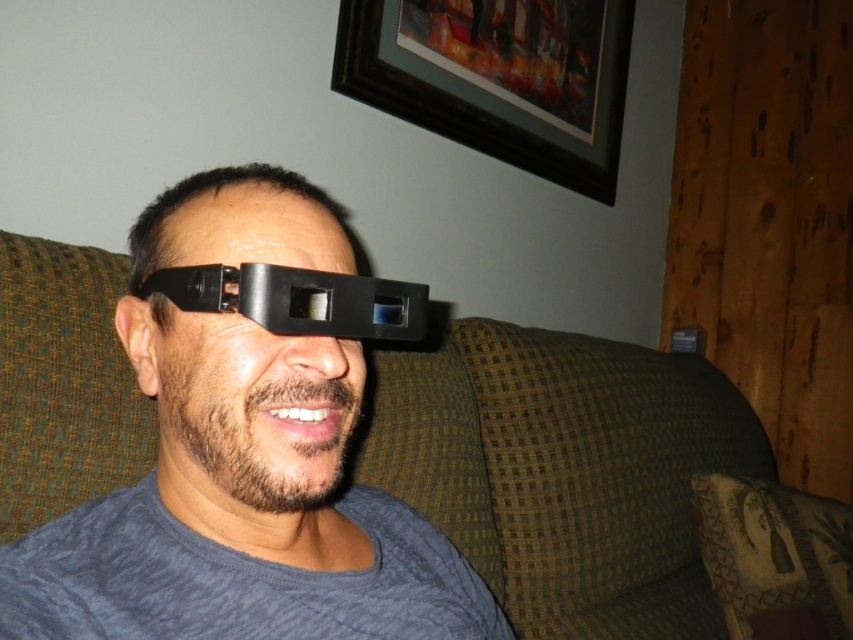
You are a photographer standing at a distance of 16 inches from a subject. You want to take a closeup shot of the black matte glasses at center. Based on the scene description, will the glasses be in focus if your camera is set to focus at 16 inches?

The black matte glasses at center is 15.95 inches from viewer. Since the camera is set to focus at 16 inches, which is very close to the actual distance of 15.95 inches, the glasses should be in focus.